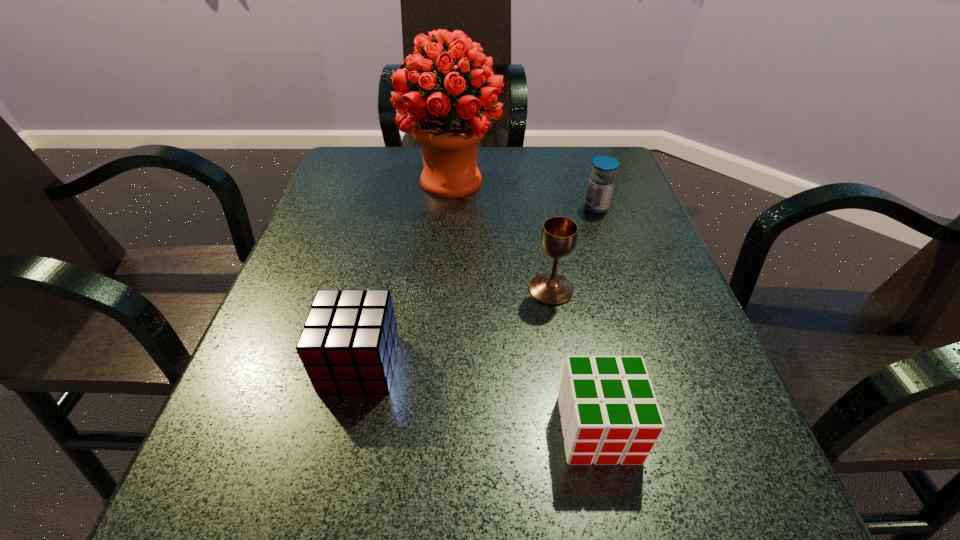
Find the location of a particular element. This screenshot has width=960, height=540. the tallest object is located at coordinates (448, 135).

What are the coordinates of `the fourth shortest object` in the screenshot? It's located at (559, 235).

In order to click on the third nearest object in this screenshot , I will do `click(559, 235)`.

Find the location of `the rightmost object`. the rightmost object is located at coordinates (601, 183).

Locate an element on the screen. The image size is (960, 540). the second nearest object is located at coordinates pos(348,344).

At what (x,y) coordinates should I click in order to perform the action: click on the left cube. Please return your answer as a coordinate pair (x, y). The image size is (960, 540). Looking at the image, I should click on (348, 344).

The width and height of the screenshot is (960, 540). Identify the location of the nearest object. (609, 415).

The height and width of the screenshot is (540, 960). Find the location of `the right cube`. the right cube is located at coordinates (609, 415).

The image size is (960, 540). Find the location of `free location located 0.110m on the left of the bouquet`. free location located 0.110m on the left of the bouquet is located at coordinates (359, 181).

The width and height of the screenshot is (960, 540). I want to click on free location located on the left of the third farthest object, so click(x=467, y=290).